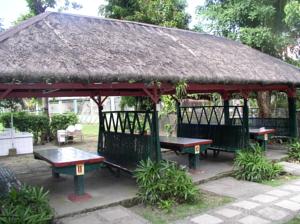
In order to click on table legs in this screenshot , I will do `click(264, 144)`, `click(195, 159)`, `click(80, 182)`, `click(54, 174)`.